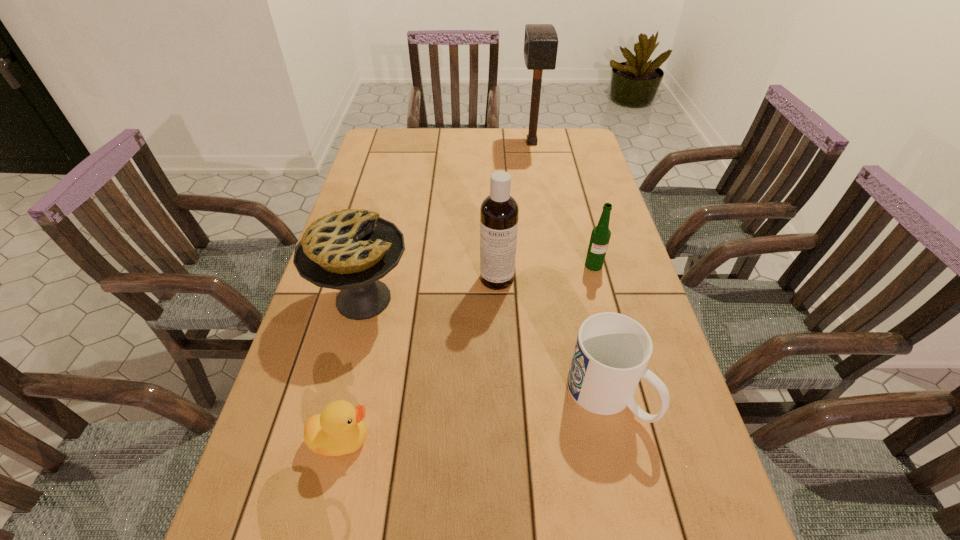
The image size is (960, 540). I want to click on vacant area located 0.250m on the cut side of the pie, so click(511, 299).

The image size is (960, 540). Identify the location of vacant space located 0.400m on the label of the beer bottle. (631, 406).

This screenshot has width=960, height=540. Find the location of `vacant space positioned 0.330m on the left of the mug`. vacant space positioned 0.330m on the left of the mug is located at coordinates (413, 395).

Identify the location of free space located 0.380m at the beak of the duck. The height and width of the screenshot is (540, 960). (566, 439).

Locate an element on the screen. object at the far edge is located at coordinates (541, 40).

You are a GUI agent. You are given a task and a screenshot of the screen. Output one action in this format:
    pyautogui.click(x=<x>, y=<y>)
    Task: Click on the pie that is at the left edge
    
    Given the screenshot: What is the action you would take?
    pyautogui.click(x=349, y=250)

Identify the location of duck at the left edge. (340, 429).

Where is `beer bottle that is at the right edge`? beer bottle that is at the right edge is located at coordinates (600, 236).

Identify the location of mug that is at the right edge. (612, 350).

In the image, there is a desktop. Where is `vacant space at the far edge`? vacant space at the far edge is located at coordinates (534, 146).